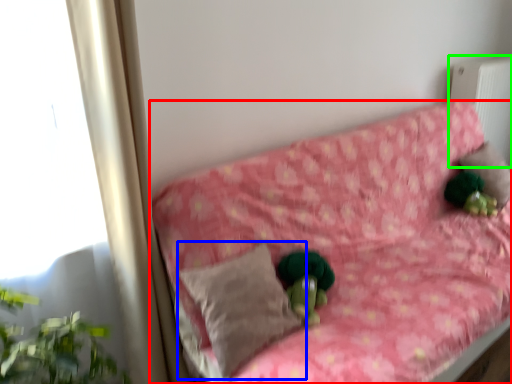
Question: Considering the real-world distances, which object is farthest from furniture (highlighted by a red box)? pillow (highlighted by a blue box) or radiator (highlighted by a green box)?

Choices:
 (A) pillow
 (B) radiator

Answer: (B)